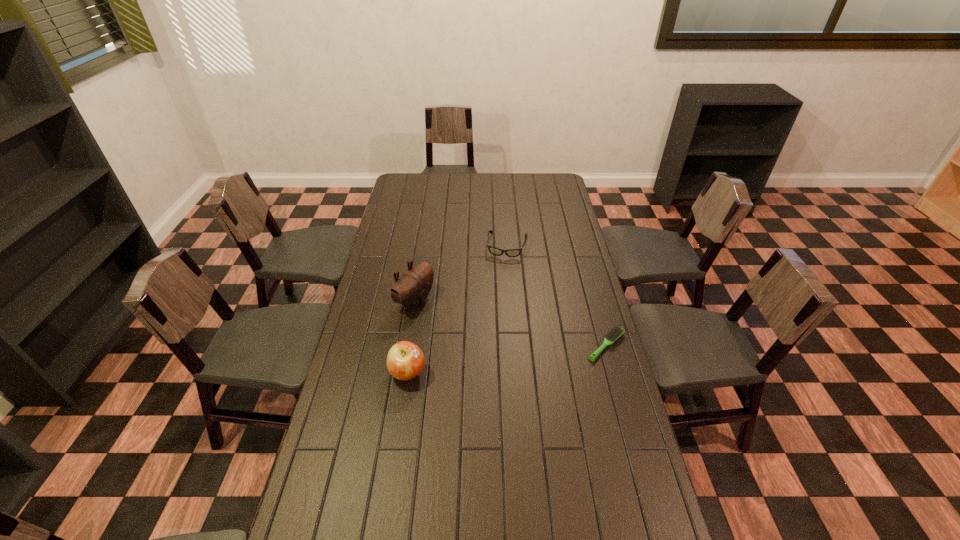
Find the location of a particular element. This screenshot has width=960, height=540. free space between the shortest object and the pouch is located at coordinates (511, 323).

The image size is (960, 540). What are the coordinates of `unoccupied position between the second tallest object and the third tallest object` in the screenshot? It's located at (458, 309).

Identify the location of unoccupied position between the rightmost object and the tallest object. The width and height of the screenshot is (960, 540). (511, 323).

Locate an element on the screen. This screenshot has width=960, height=540. vacant space that's between the hairbrush and the tallest object is located at coordinates (511, 323).

Image resolution: width=960 pixels, height=540 pixels. I want to click on the closest object relative to the shortest object, so click(x=495, y=251).

Locate which object is the closest to the apple. Please provide its 2D coordinates. Your answer should be formatted as a tuple, i.e. [(x, y)], where the tuple contains the x and y coordinates of a point satisfying the conditions above.

[(411, 290)]

In order to click on vacant area in the image that satisfies the following two spatial constraints: 1. on the back side of the third tallest object; 2. on the left side of the tallest object in this screenshot , I will do `click(424, 246)`.

The image size is (960, 540). I want to click on free location that satisfies the following two spatial constraints: 1. on the front side of the hairbrush; 2. on the right side of the farthest object, so click(x=515, y=345).

You are a GUI agent. You are given a task and a screenshot of the screen. Output one action in this format:
    pyautogui.click(x=<x>, y=<y>)
    Task: Click on the vacant space that satisfies the following two spatial constraints: 1. on the front side of the third tallest object; 2. on the right side of the shortest object
    
    Given the screenshot: What is the action you would take?
    [x=515, y=345]

Identify the location of vacant space that satisfies the following two spatial constraints: 1. on the front side of the second shortest object; 2. on the right side of the rightmost object. Image resolution: width=960 pixels, height=540 pixels. (515, 345).